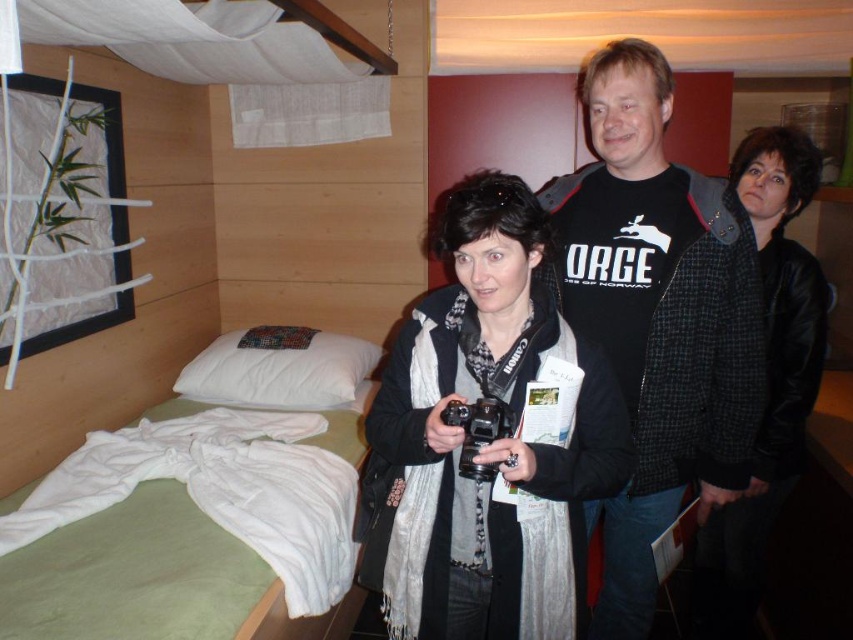
Question: Based on their relative distances, which object is farther from the black woolen scarf at center?

Choices:
 (A) black cotton t-shirt at center
 (B) black leather jacket at center
 (C) white fabric bed at lower left

Answer: (B)

Question: Which point appears closest to the camera in this image?

Choices:
 (A) (79, 490)
 (B) (611, 636)
 (C) (816, 156)

Answer: (A)

Question: Does black cotton t-shirt at center lie behind black plastic camera at center?

Choices:
 (A) no
 (B) yes

Answer: (B)

Question: Among these objects, which one is farthest from the camera?

Choices:
 (A) black woolen scarf at center
 (B) black leather jacket at center
 (C) white fabric bed at lower left

Answer: (B)

Question: Is black cotton t-shirt at center further to the viewer compared to black plastic camera at center?

Choices:
 (A) yes
 (B) no

Answer: (A)

Question: In this image, where is black cotton t-shirt at center located relative to black leather jacket at center?

Choices:
 (A) right
 (B) left

Answer: (B)